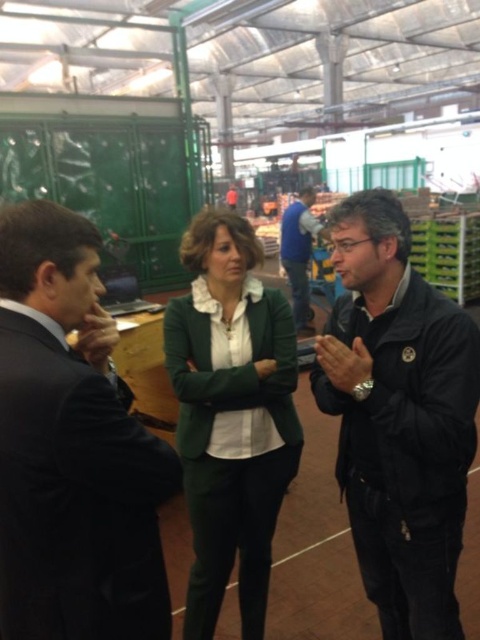
Question: Which of the following is the closest to the observer?

Choices:
 (A) (68, 381)
 (B) (307, 259)

Answer: (A)

Question: Can you confirm if black suit at left is bigger than black matte jacket at right?

Choices:
 (A) no
 (B) yes

Answer: (A)

Question: Is black matte jacket at right bigger than blue denim jeans at center?

Choices:
 (A) yes
 (B) no

Answer: (B)

Question: Does black matte jacket at right have a greater width compared to green fabric jacket at center?

Choices:
 (A) yes
 (B) no

Answer: (B)

Question: Which point appears closest to the camera in this image?

Choices:
 (A) (73, 282)
 (B) (302, 244)
 (C) (410, 326)

Answer: (A)

Question: Which object appears closest to the camera in this image?

Choices:
 (A) black matte jacket at right
 (B) green fabric jacket at center
 (C) black suit at left

Answer: (C)